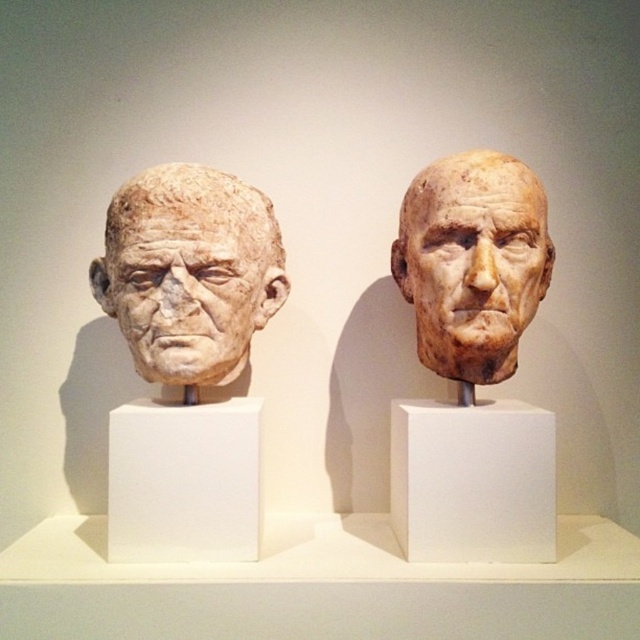
Does matte clay head at center have a greater height compared to matte stone head at left?

Correct, matte clay head at center is much taller as matte stone head at left.

Based on the photo, is the position of matte clay head at center less distant than that of matte stone head at left?

Yes.

Where is `matte clay head at center`? matte clay head at center is located at coordinates (472, 257).

Image resolution: width=640 pixels, height=640 pixels. Find the location of `matte clay head at center`. matte clay head at center is located at coordinates (472, 257).